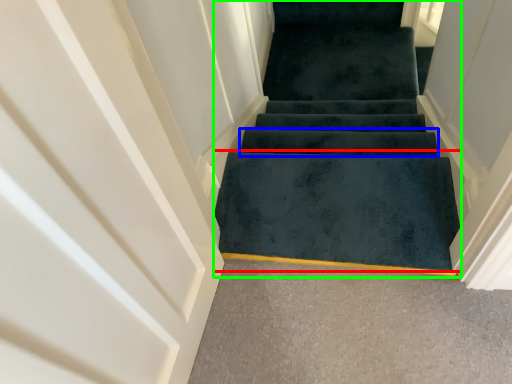
Question: Which object is the closest to the doormat (highlighted by a red box)? Choose among these: stair (highlighted by a blue box) or stairs (highlighted by a green box).

Choices:
 (A) stair
 (B) stairs

Answer: (A)